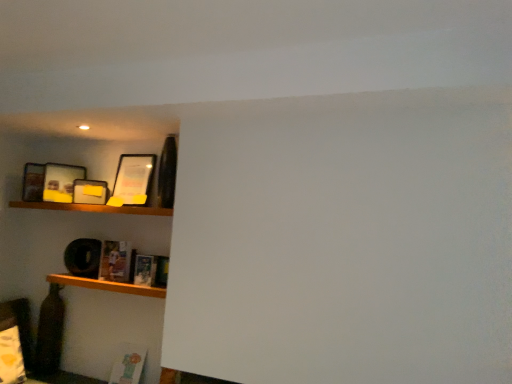
Question: From a real-world perspective, is hardcover book at lower left, the second book from the left, over matte black picture frame at upper left, arranged as the first picture frame when viewed from the left?

Choices:
 (A) yes
 (B) no

Answer: (B)

Question: From the image's perspective, is hardcover book at lower left, the first book in the front-to-back sequence, located beneath matte black picture frame at upper left, the third picture frame in the right-to-left sequence?

Choices:
 (A) yes
 (B) no

Answer: (A)

Question: Are hardcover book at lower left, which is the second book in back-to-front order, and matte black picture frame at upper left, the third picture frame in the right-to-left sequence, making contact?

Choices:
 (A) no
 (B) yes

Answer: (A)

Question: Considering the relative sizes of hardcover book at lower left, the first book from the right, and matte black picture frame at upper left, the third picture frame in the right-to-left sequence, in the image provided, is hardcover book at lower left, the first book from the right, bigger than matte black picture frame at upper left, the third picture frame in the right-to-left sequence,?

Choices:
 (A) no
 (B) yes

Answer: (A)

Question: Is hardcover book at lower left, which is the second book in back-to-front order, further to the viewer compared to matte black picture frame at upper left, arranged as the first picture frame when viewed from the left?

Choices:
 (A) yes
 (B) no

Answer: (B)

Question: From the image's perspective, relative to hardcover book at lower left, which is the second book in back-to-front order, is matte paper book at lower left, placed as the 2th book when sorted from right to left, above or below?

Choices:
 (A) below
 (B) above

Answer: (B)

Question: From a real-world perspective, is matte paper book at lower left, the second book in the front-to-back sequence, physically located above or below hardcover book at lower left, the second book from the left?

Choices:
 (A) above
 (B) below

Answer: (A)

Question: In terms of width, does matte paper book at lower left, arranged as the first book when viewed from the back, look wider or thinner when compared to hardcover book at lower left, the second book from the left?

Choices:
 (A) thin
 (B) wide

Answer: (B)

Question: Is point (104, 248) positioned closer to the camera than point (140, 264)?

Choices:
 (A) closer
 (B) farther

Answer: (B)

Question: Is matte paper book at lower left, arranged as the first book when viewed from the back, taller or shorter than matte yellow picture frame at upper left, arranged as the second picture frame when viewed from the left?

Choices:
 (A) tall
 (B) short

Answer: (A)

Question: Does point (101, 266) appear closer or farther from the camera than point (105, 182)?

Choices:
 (A) farther
 (B) closer

Answer: (B)

Question: Is matte paper book at lower left, which appears as the 1th book when viewed from the left, to the left or to the right of matte yellow picture frame at upper left, arranged as the second picture frame when viewed from the left, in the image?

Choices:
 (A) right
 (B) left

Answer: (A)

Question: Would you say matte paper book at lower left, which appears as the 1th book when viewed from the left, is inside or outside matte yellow picture frame at upper left, the second picture frame when ordered from right to left?

Choices:
 (A) inside
 (B) outside

Answer: (B)

Question: Considering the positions of wooden shelf at lower left, which ranks as the 1th shelf in bottom-to-top order, and matte paper book at lower left, the second book in the front-to-back sequence, in the image, is wooden shelf at lower left, which ranks as the 1th shelf in bottom-to-top order, wider or thinner than matte paper book at lower left, the second book in the front-to-back sequence,?

Choices:
 (A) thin
 (B) wide

Answer: (B)

Question: Choose the correct answer: Is wooden shelf at lower left, which ranks as the 1th shelf in bottom-to-top order, inside matte paper book at lower left, which appears as the 1th book when viewed from the left, or outside it?

Choices:
 (A) inside
 (B) outside

Answer: (B)